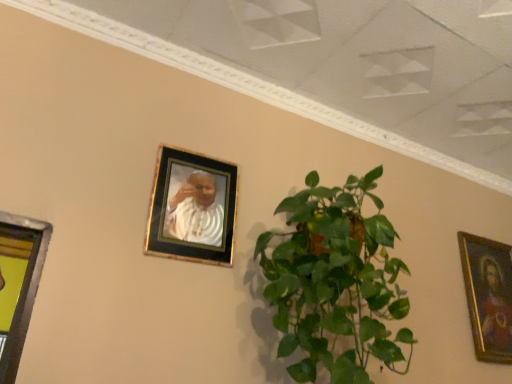
Question: Considering the relative positions of gold-framed photo at upper center, placed as the 2th picture frame when sorted from bottom to top, and gold-framed painting at right, arranged as the first picture frame when viewed from the back, in the image provided, is gold-framed photo at upper center, placed as the 2th picture frame when sorted from bottom to top, to the left of gold-framed painting at right, arranged as the first picture frame when viewed from the back, from the viewer's perspective?

Choices:
 (A) yes
 (B) no

Answer: (A)

Question: Considering the relative sizes of gold-framed photo at upper center, the 2th picture frame positioned from the right, and gold-framed painting at right, acting as the first picture frame starting from the bottom, in the image provided, is gold-framed photo at upper center, the 2th picture frame positioned from the right, shorter than gold-framed painting at right, acting as the first picture frame starting from the bottom,?

Choices:
 (A) no
 (B) yes

Answer: (B)

Question: Can you confirm if gold-framed photo at upper center, placed as the first picture frame when sorted from left to right, is bigger than gold-framed painting at right, which is the 2th picture frame in top-to-bottom order?

Choices:
 (A) yes
 (B) no

Answer: (B)

Question: Does gold-framed photo at upper center, the second picture frame positioned from the back, come behind gold-framed painting at right, the 2th picture frame when ordered from front to back?

Choices:
 (A) no
 (B) yes

Answer: (A)

Question: Is gold-framed painting at right, positioned as the second picture frame in left-to-right order, located within gold-framed photo at upper center, placed as the 2th picture frame when sorted from bottom to top?

Choices:
 (A) no
 (B) yes

Answer: (A)

Question: From the image's perspective, does gold-framed photo at upper center, placed as the 2th picture frame when sorted from bottom to top, appear higher than gold-framed painting at right, arranged as the first picture frame when viewed from the right?

Choices:
 (A) yes
 (B) no

Answer: (A)

Question: Is green leafy plant at center inside gold-framed photo at upper center, arranged as the first picture frame when viewed from the top?

Choices:
 (A) yes
 (B) no

Answer: (B)

Question: Is gold-framed photo at upper center, the second picture frame positioned from the back, thinner than green leafy plant at center?

Choices:
 (A) yes
 (B) no

Answer: (A)

Question: Is gold-framed photo at upper center, positioned as the 1th picture frame in front-to-back order, shorter than green leafy plant at center?

Choices:
 (A) no
 (B) yes

Answer: (B)

Question: Is gold-framed photo at upper center, positioned as the 1th picture frame in front-to-back order, positioned in front of green leafy plant at center?

Choices:
 (A) no
 (B) yes

Answer: (A)

Question: Is gold-framed photo at upper center, positioned as the 1th picture frame in front-to-back order, far away from green leafy plant at center?

Choices:
 (A) yes
 (B) no

Answer: (B)

Question: Does gold-framed photo at upper center, arranged as the first picture frame when viewed from the top, have a greater width compared to green leafy plant at center?

Choices:
 (A) no
 (B) yes

Answer: (A)

Question: Is gold-framed painting at right, the 2th picture frame when ordered from front to back, completely or partially outside of green leafy plant at center?

Choices:
 (A) yes
 (B) no

Answer: (A)